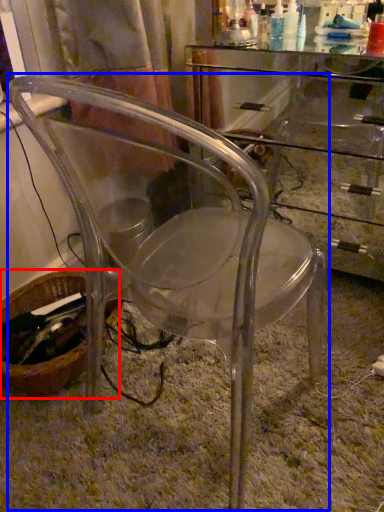
Question: Which of the following is the farthest to the observer, basket (highlighted by a red box) or chair (highlighted by a blue box)?

Choices:
 (A) basket
 (B) chair

Answer: (A)